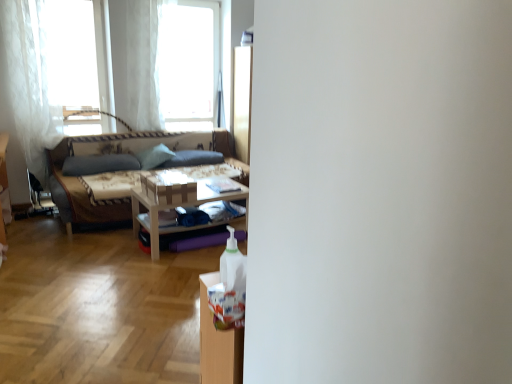
Question: Should I look upward or downward to see dark gray fabric pillow at center, arranged as the third pillow when viewed from the left?

Choices:
 (A) up
 (B) down

Answer: (A)

Question: Which direction should I rotate to look at green fabric pillow at center, which ranks as the 2th pillow in left-to-right order, — up or down?

Choices:
 (A) down
 (B) up

Answer: (B)

Question: From the image's perspective, is transparent glass window at upper center, arranged as the second window when viewed from the left, above white sheer curtain at left, the second curtain viewed from the right?

Choices:
 (A) no
 (B) yes

Answer: (B)

Question: Can you confirm if transparent glass window at upper center, marked as the 1th window in a right-to-left arrangement, is taller than white sheer curtain at left, the second curtain viewed from the right?

Choices:
 (A) yes
 (B) no

Answer: (B)

Question: Does transparent glass window at upper center, arranged as the second window when viewed from the left, appear on the right side of white sheer curtain at left, the second curtain viewed from the right?

Choices:
 (A) yes
 (B) no

Answer: (A)

Question: Does transparent glass window at upper center, arranged as the second window when viewed from the left, have a larger size compared to white sheer curtain at left, the 1th curtain positioned from the left?

Choices:
 (A) no
 (B) yes

Answer: (B)

Question: Is the position of transparent glass window at upper center, marked as the 1th window in a right-to-left arrangement, more distant than that of white sheer curtain at left, the second curtain viewed from the right?

Choices:
 (A) yes
 (B) no

Answer: (A)

Question: Is transparent glass window at upper center, arranged as the second window when viewed from the left, not inside white sheer curtain at left, the second curtain viewed from the right?

Choices:
 (A) no
 (B) yes

Answer: (B)

Question: From the image's perspective, is dark gray fabric pillow at center, arranged as the third pillow when viewed from the left, below white sheer curtain at upper left, the 1th curtain positioned from the right?

Choices:
 (A) yes
 (B) no

Answer: (A)

Question: Is dark gray fabric pillow at center, arranged as the third pillow when viewed from the left, facing towards white sheer curtain at upper left, which appears as the second curtain when viewed from the left?

Choices:
 (A) yes
 (B) no

Answer: (B)

Question: Is dark gray fabric pillow at center, which is the 1th pillow from right to left, not within white sheer curtain at upper left, which appears as the second curtain when viewed from the left?

Choices:
 (A) yes
 (B) no

Answer: (A)

Question: Is dark gray fabric pillow at center, arranged as the third pillow when viewed from the left, turned away from white sheer curtain at upper left, the 1th curtain positioned from the right?

Choices:
 (A) yes
 (B) no

Answer: (B)

Question: Considering the relative sizes of dark gray fabric pillow at center, which is the 1th pillow from right to left, and white sheer curtain at upper left, which appears as the second curtain when viewed from the left, in the image provided, is dark gray fabric pillow at center, which is the 1th pillow from right to left, wider than white sheer curtain at upper left, which appears as the second curtain when viewed from the left,?

Choices:
 (A) no
 (B) yes

Answer: (B)

Question: From a real-world perspective, is dark gray fabric pillow at center, arranged as the third pillow when viewed from the left, physically above white sheer curtain at upper left, which appears as the second curtain when viewed from the left?

Choices:
 (A) yes
 (B) no

Answer: (B)

Question: From the image's perspective, is green fabric pillow at center, which ranks as the 2th pillow in left-to-right order, located above white sheer curtain at upper left, the first window when ordered from left to right?

Choices:
 (A) yes
 (B) no

Answer: (B)